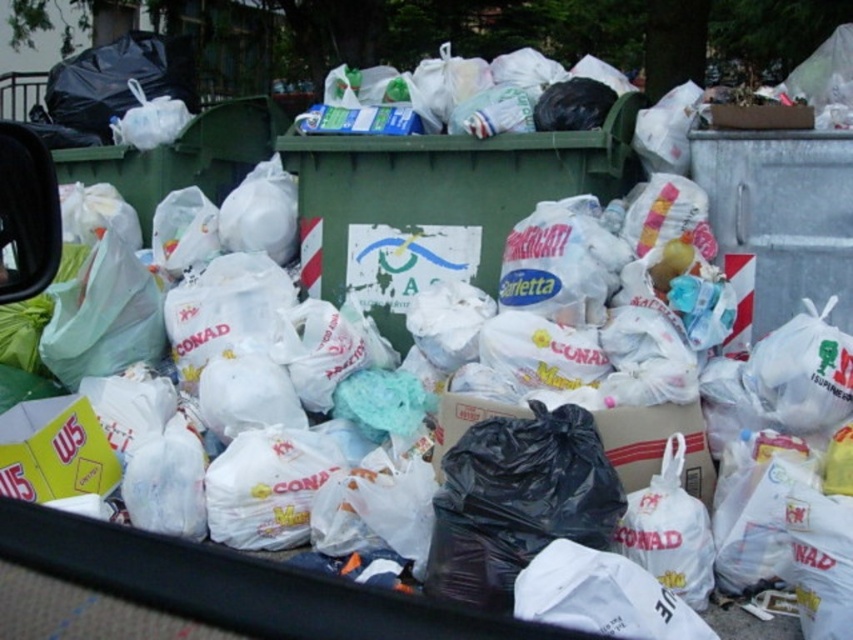
You are a sanitation worker who needs to place a new recycling bin that is 1.2 meters wide in this area. The new bin must be placed next to either the green plastic recycling bin at center or the metallic gray recycling bin at upper right. Based on their widths, which existing bin should you choose to place the new bin next to, and why?

The green plastic recycling bin at center is wider than the metallic gray recycling bin at upper right. Therefore, placing the new 1.2 meters wide bin next to the green plastic recycling bin at center would be more appropriate as it can accommodate the size difference better.

You are a waste management worker who needs to place a new large trash bag into one of the bins. The bag is 1 meter tall. Which bin should you choose between the green plastic recycling bin at center and the metallic gray recycling bin at upper right?

The green plastic recycling bin at center is taller than the metallic gray recycling bin at upper right, so you should choose the green plastic recycling bin at center to place the new large trash bag since it can accommodate the height of the bag.